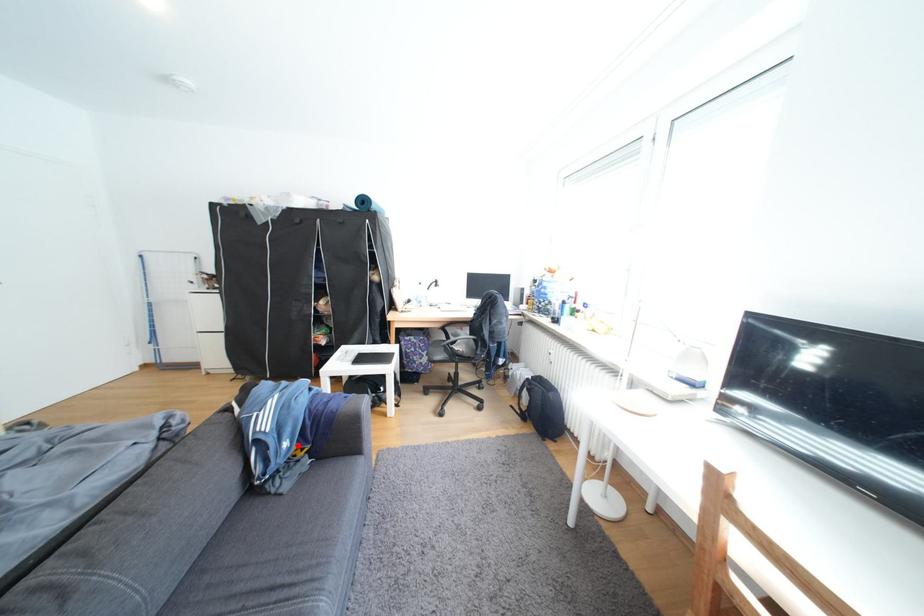
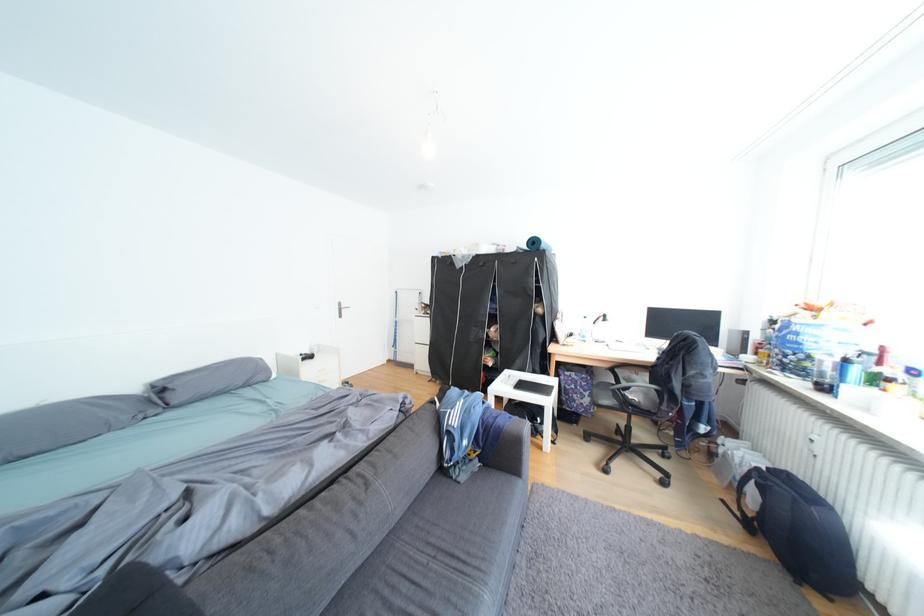
Where in the second image is the point corresponding to the highlighted location from the first image?

(478, 444)